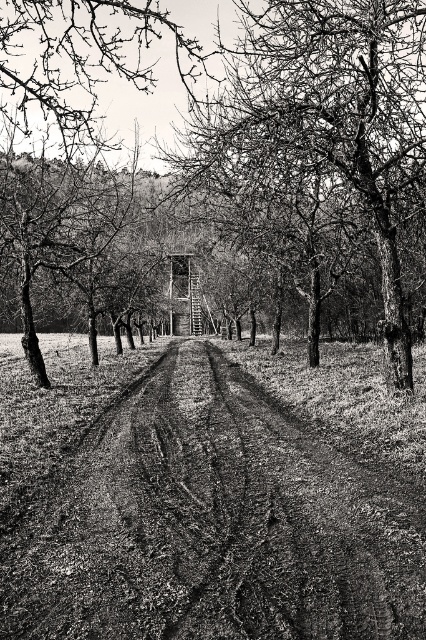
This screenshot has width=426, height=640. Describe the element at coordinates (210, 524) in the screenshot. I see `dirt track at center` at that location.

The image size is (426, 640). Find the location of `dirt track at center`. dirt track at center is located at coordinates (210, 524).

Is point (363, 586) closer to camera compared to point (258, 72)?

Yes, it is in front of point (258, 72).

Where is `dirt track at center`? The image size is (426, 640). dirt track at center is located at coordinates (210, 524).